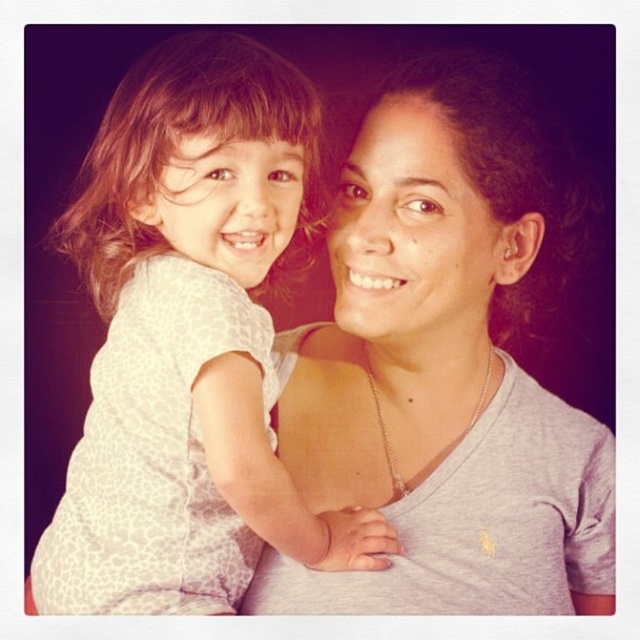
Question: Can you confirm if gray matte shirt at center is positioned to the right of white leopard print shirt at upper left?

Choices:
 (A) no
 (B) yes

Answer: (B)

Question: Which object appears farthest from the camera in this image?

Choices:
 (A) gray matte shirt at center
 (B) white leopard print shirt at upper left

Answer: (A)

Question: Can you confirm if gray matte shirt at center is bigger than white leopard print shirt at upper left?

Choices:
 (A) yes
 (B) no

Answer: (A)

Question: From the image, what is the correct spatial relationship of gray matte shirt at center in relation to white leopard print shirt at upper left?

Choices:
 (A) above
 (B) below

Answer: (B)